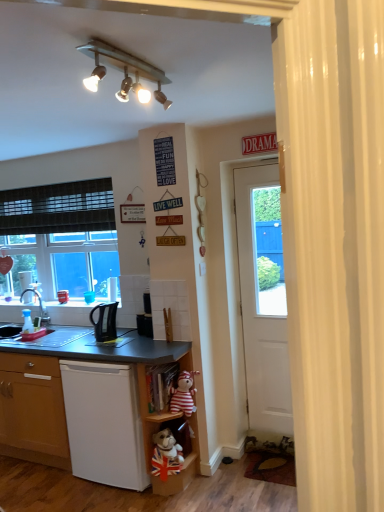
Where is `vacant space in front of wooden shelf at lower center, arranged as the second shelf when ordered from the bottom`? vacant space in front of wooden shelf at lower center, arranged as the second shelf when ordered from the bottom is located at coordinates (183, 505).